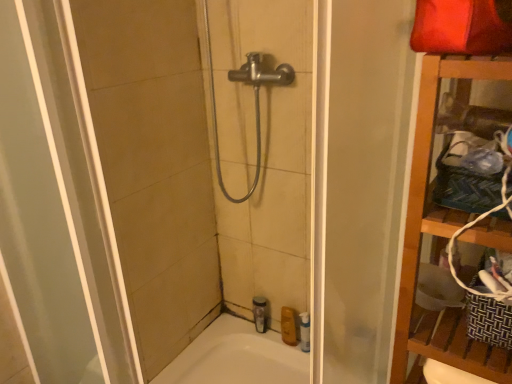
Question: Which direction should I rotate to look at yellow matte bottle at lower center, which ranks as the 2th toiletry in left-to-right order, — up or down?

Choices:
 (A) up
 (B) down

Answer: (B)

Question: Can you confirm if yellow matte bottle at lower center, which ranks as the 2th toiletry in left-to-right order, is positioned to the left of transparent plastic shower door at center?

Choices:
 (A) no
 (B) yes

Answer: (A)

Question: Can you confirm if yellow matte bottle at lower center, arranged as the first toiletry when viewed from the right, is thinner than transparent plastic shower door at center?

Choices:
 (A) no
 (B) yes

Answer: (B)

Question: Does yellow matte bottle at lower center, arranged as the first toiletry when viewed from the right, have a larger size compared to transparent plastic shower door at center?

Choices:
 (A) no
 (B) yes

Answer: (A)

Question: Considering the relative sizes of yellow matte bottle at lower center, arranged as the first toiletry when viewed from the right, and transparent plastic shower door at center in the image provided, is yellow matte bottle at lower center, arranged as the first toiletry when viewed from the right, taller than transparent plastic shower door at center?

Choices:
 (A) no
 (B) yes

Answer: (A)

Question: Considering the relative sizes of yellow matte bottle at lower center, which ranks as the 2th toiletry in left-to-right order, and transparent plastic shower door at center in the image provided, is yellow matte bottle at lower center, which ranks as the 2th toiletry in left-to-right order, smaller than transparent plastic shower door at center?

Choices:
 (A) yes
 (B) no

Answer: (A)

Question: Is yellow matte bottle at lower center, which ranks as the 2th toiletry in left-to-right order, positioned far away from transparent plastic shower door at center?

Choices:
 (A) yes
 (B) no

Answer: (B)

Question: Is clear plastic bottle at lower center, which is the second toiletry from right to left, not near yellow matte bottle at lower center, which ranks as the 2th toiletry in left-to-right order?

Choices:
 (A) yes
 (B) no

Answer: (B)

Question: Considering the relative positions of clear plastic bottle at lower center, which is the second toiletry from right to left, and yellow matte bottle at lower center, which ranks as the 2th toiletry in left-to-right order, in the image provided, is clear plastic bottle at lower center, which is the second toiletry from right to left, to the left of yellow matte bottle at lower center, which ranks as the 2th toiletry in left-to-right order, from the viewer's perspective?

Choices:
 (A) no
 (B) yes

Answer: (B)

Question: From the image's perspective, would you say clear plastic bottle at lower center, the 1th toiletry from the left, is positioned over yellow matte bottle at lower center, arranged as the first toiletry when viewed from the right?

Choices:
 (A) yes
 (B) no

Answer: (A)

Question: Is clear plastic bottle at lower center, which is the second toiletry from right to left, bigger than yellow matte bottle at lower center, arranged as the first toiletry when viewed from the right?

Choices:
 (A) yes
 (B) no

Answer: (B)

Question: Is clear plastic bottle at lower center, the 1th toiletry from the left, to the right of yellow matte bottle at lower center, which ranks as the 2th toiletry in left-to-right order, from the viewer's perspective?

Choices:
 (A) no
 (B) yes

Answer: (A)

Question: Can you confirm if clear plastic bottle at lower center, which is the second toiletry from right to left, is smaller than yellow matte bottle at lower center, arranged as the first toiletry when viewed from the right?

Choices:
 (A) no
 (B) yes

Answer: (B)

Question: From a real-world perspective, is clear plastic bottle at lower center, the 1th toiletry from the left, positioned under white glossy bathtub at lower center based on gravity?

Choices:
 (A) no
 (B) yes

Answer: (A)